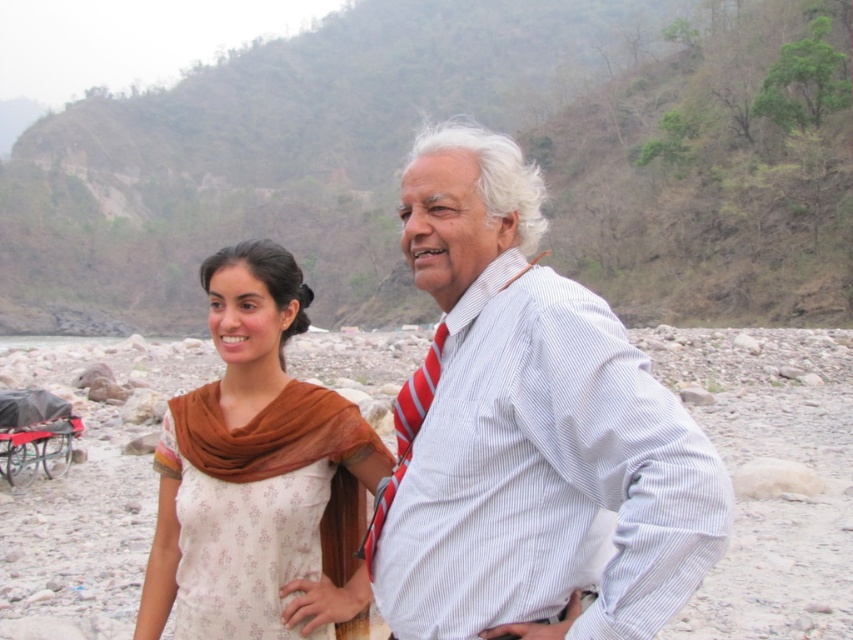
Is white striped shirt at center further to camera compared to matte orange scarf at center?

No, it is in front of matte orange scarf at center.

Does point (543, 282) lie in front of point (279, 252)?

That is True.

Image resolution: width=853 pixels, height=640 pixels. What are the coordinates of `white striped shirt at center` in the screenshot? It's located at (529, 433).

How far apart are matte orange scarf at center and red striped tie at center?

The distance of matte orange scarf at center from red striped tie at center is 16.61 feet.

Which of these two, matte orange scarf at center or red striped tie at center, stands shorter?

red striped tie at center is shorter.

You are a GUI agent. You are given a task and a screenshot of the screen. Output one action in this format:
    pyautogui.click(x=<x>, y=<y>)
    Task: Click on the matte orange scarf at center
    
    Given the screenshot: What is the action you would take?
    pyautogui.click(x=258, y=472)

Can you confirm if white striped shirt at center is positioned to the left of red striped tie at center?

Incorrect, white striped shirt at center is not on the left side of red striped tie at center.

Locate an element on the screen. white striped shirt at center is located at coordinates (529, 433).